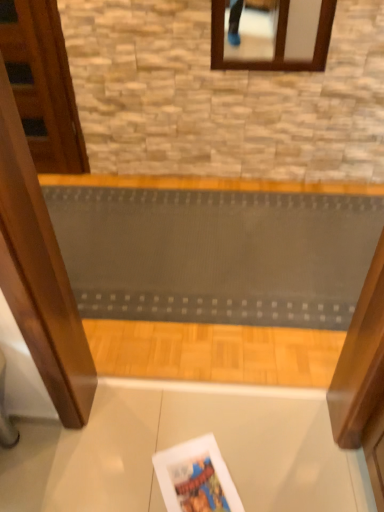
The width and height of the screenshot is (384, 512). I want to click on vacant space that is to the left of matte paper magazine at lower center, so pos(129,471).